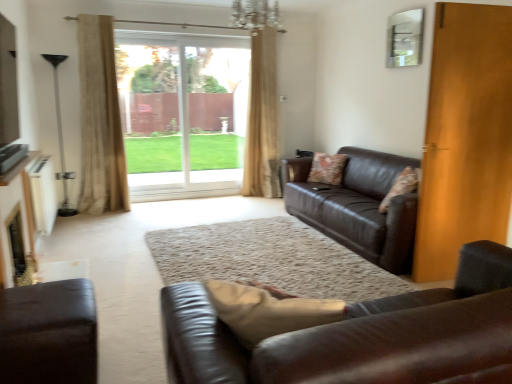
Question: From the image's perspective, is beige textured curtain at center, which appears as the 1th curtain when viewed from the right, above or below crystal glass chandelier at upper center?

Choices:
 (A) below
 (B) above

Answer: (A)

Question: From a real-world perspective, is beige textured curtain at center, which appears as the 1th curtain when viewed from the right, physically located above or below crystal glass chandelier at upper center?

Choices:
 (A) below
 (B) above

Answer: (A)

Question: Which object is the closest to the floral fabric pillow at center, marked as the first pillow in a left-to-right arrangement?

Choices:
 (A) fluffy fabric pillow at right, the second pillow when ordered from left to right
 (B) matte brown leather couch at right, which ranks as the 3th studio couch in front-to-back order
 (C) crystal glass chandelier at upper center
 (D) beige textured curtain at left, arranged as the 1th curtain when viewed from the front
 (E) beige textured curtain at center, the second curtain positioned from the front

Answer: (B)

Question: Which of these objects is positioned farthest from the floral fabric pillow at center, which is counted as the second pillow, starting from the front?

Choices:
 (A) transparent glass door at center
 (B) fluffy fabric pillow at right, positioned as the second pillow in back-to-front order
 (C) leather couch at center, marked as the 3th studio couch in a back-to-front arrangement
 (D) wooden door at right
 (E) beige textured curtain at left, which is the first curtain in left-to-right order

Answer: (C)